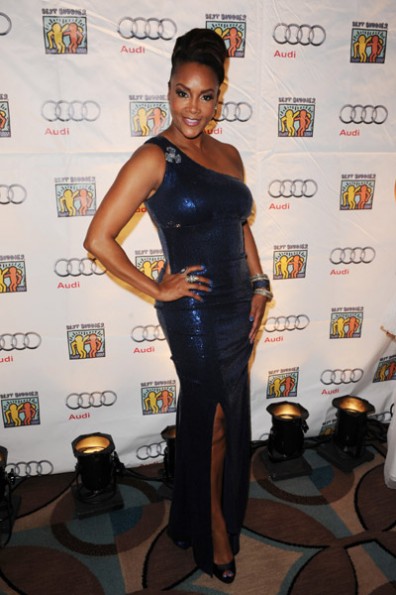
You are a GUI agent. You are given a task and a screenshot of the screen. Output one action in this format:
    pyautogui.click(x=<x>, y=<y>)
    Task: Click on the chest
    This screenshot has height=595, width=396.
    Given the screenshot: What is the action you would take?
    pyautogui.click(x=218, y=164)